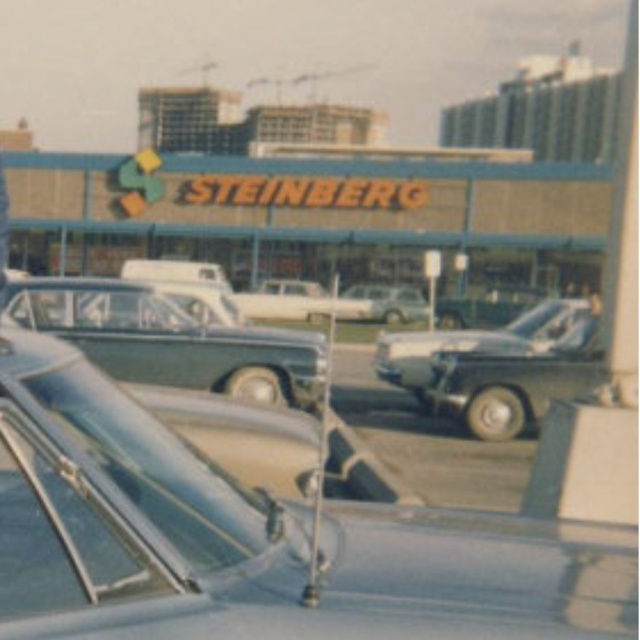
Question: Among these objects, which one is farthest from the camera?

Choices:
 (A) shiny silver sedan at center
 (B) shiny silver car at center
 (C) white glossy station wagon at center
 (D) white glossy sedan at center

Answer: (D)

Question: Can you confirm if shiny silver sedan at center is positioned to the left of white glossy sedan at center?

Choices:
 (A) no
 (B) yes

Answer: (B)

Question: Which point is closer to the camera?

Choices:
 (A) (556, 337)
 (B) (371, 298)
 (C) (358, 307)
 (D) (116, 336)

Answer: (D)

Question: Which point is farther from the camera taking this photo?

Choices:
 (A) (339, 314)
 (B) (536, 353)
 (C) (284, 392)

Answer: (A)

Question: Is shiny silver sedan at center above shiny silver car at center?

Choices:
 (A) yes
 (B) no

Answer: (A)

Question: Does shiny silver sedan at center come in front of white glossy sedan at center?

Choices:
 (A) no
 (B) yes

Answer: (B)